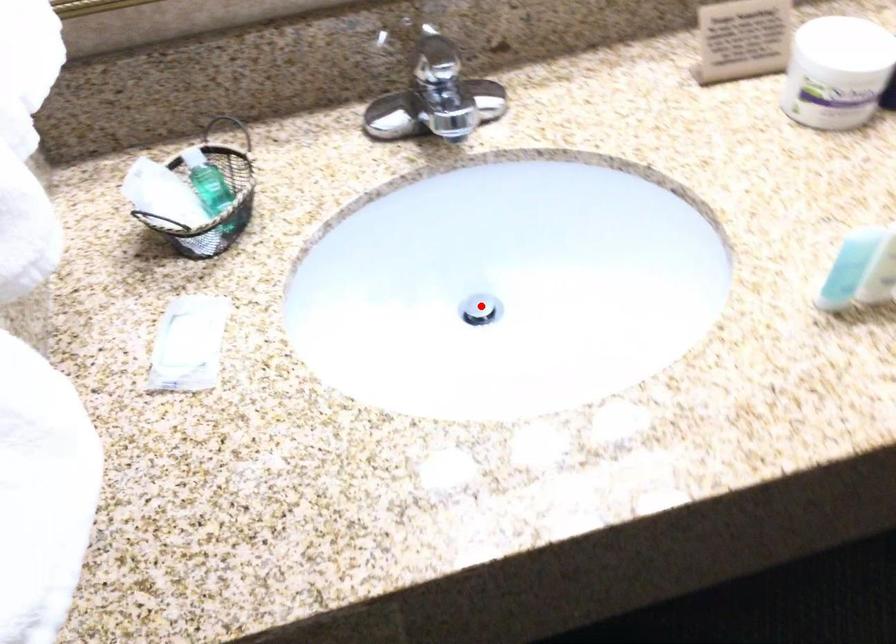
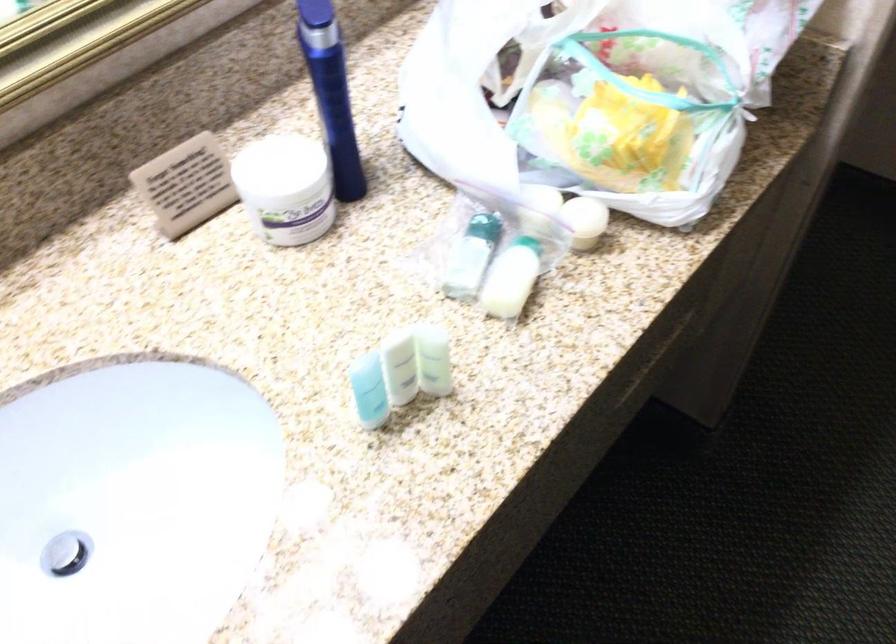
Question: A red point is marked in image1. In image2, is the corresponding 3D point closer to the camera or farther? Reply with the corresponding letter.

Choices:
 (A) The corresponding 3D point is closer.
 (B) The corresponding 3D point is farther.

Answer: (A)